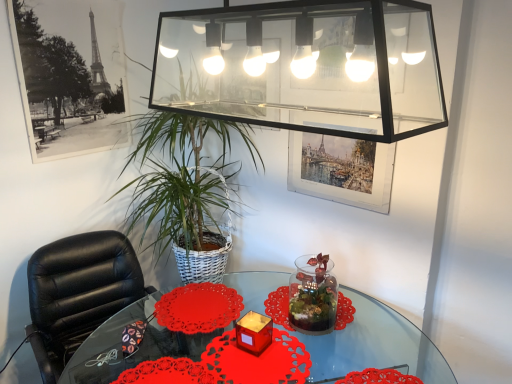
Identify the location of watercolor paper picture frame at upper center, which is counted as the first picture frame, starting from the right. (341, 169).

This screenshot has width=512, height=384. Describe the element at coordinates (313, 295) in the screenshot. I see `transparent glass vase at center` at that location.

Measure the distance between point [100,68] and camera.

Point [100,68] and camera are 2.02 meters apart from each other.

What is the approximate height of transparent glass table at center?

28.82 inches.

This screenshot has width=512, height=384. What do you see at coordinates (78, 293) in the screenshot? I see `black leather chair at left` at bounding box center [78, 293].

You are a GUI agent. You are given a task and a screenshot of the screen. Output one action in this format:
    pyautogui.click(x=<x>, y=<y>)
    Task: Click on the translucent glass candle at center
    Image resolution: width=512 pixels, height=384 pixels.
    Given the screenshot: What is the action you would take?
    pyautogui.click(x=254, y=332)

The height and width of the screenshot is (384, 512). Identify the location of watercolor paper picture frame at upper center, which is counted as the second picture frame, starting from the left. (341, 169).

From a real-world perspective, which object rests below the other?

transparent glass vase at center is physically lower.

What's the angular difference between transparent glass vase at center and black paper picture frame at upper left, acting as the second picture frame starting from the right,'s facing directions?

The angle between the facing direction of transparent glass vase at center and the facing direction of black paper picture frame at upper left, acting as the second picture frame starting from the right, is 4.14 degrees.

Is black paper picture frame at upper left, placed as the 1th picture frame when sorted from left to right, at the back of transparent glass vase at center?

No, transparent glass vase at center is not facing away from black paper picture frame at upper left, placed as the 1th picture frame when sorted from left to right.

Is transparent glass vase at center not close to black paper picture frame at upper left, acting as the second picture frame starting from the right?

Yes, transparent glass vase at center is far from black paper picture frame at upper left, acting as the second picture frame starting from the right.

Does translucent glass candle at center have a greater width compared to clear glass light fixture at upper center?

No.

Considering the sizes of objects translucent glass candle at center and clear glass light fixture at upper center in the image provided, who is taller, translucent glass candle at center or clear glass light fixture at upper center?

clear glass light fixture at upper center is taller.

Looking at the image, does translucent glass candle at center seem bigger or smaller compared to clear glass light fixture at upper center?

translucent glass candle at center is smaller than clear glass light fixture at upper center.

You are a GUI agent. You are given a task and a screenshot of the screen. Output one action in this format:
    pyautogui.click(x=<x>, y=<y>)
    Task: Click on the picture frame on the right of black paper picture frame at upper left, placed as the 1th picture frame when sorted from left to right
    This screenshot has height=384, width=512.
    Given the screenshot: What is the action you would take?
    pyautogui.click(x=341, y=169)

Considering the positions of points (329, 139) and (74, 92), is point (329, 139) farther from camera compared to point (74, 92)?

No.

Is watercolor paper picture frame at upper center, which is counted as the second picture frame, starting from the left, spatially inside black paper picture frame at upper left, placed as the 1th picture frame when sorted from left to right, or outside of it?

watercolor paper picture frame at upper center, which is counted as the second picture frame, starting from the left, cannot be found inside black paper picture frame at upper left, placed as the 1th picture frame when sorted from left to right.

From a real-world perspective, which is physically above, watercolor paper picture frame at upper center, which is counted as the second picture frame, starting from the left, or black paper picture frame at upper left, placed as the 1th picture frame when sorted from left to right?

black paper picture frame at upper left, placed as the 1th picture frame when sorted from left to right, from a real-world perspective.

Which of these two, translucent glass candle at center or red paper doily at center, is thinner?

With smaller width is translucent glass candle at center.

Is translucent glass candle at center positioned behind red paper doily at center?

No.

You are a GUI agent. You are given a task and a screenshot of the screen. Output one action in this format:
    pyautogui.click(x=<x>, y=<y>)
    Task: Click on the flower above the translucent glass candle at center (from the image's perspective)
    Image resolution: width=512 pixels, height=384 pixels.
    Given the screenshot: What is the action you would take?
    pyautogui.click(x=198, y=308)

From a real-world perspective, is translucent glass candle at center positioned above or below red paper doily at center?

Clearly, from a real-world perspective, translucent glass candle at center is above red paper doily at center.

From the image's perspective, which is below, translucent glass candle at center or transparent glass table at center?

From the image's view, transparent glass table at center is below.

Is translucent glass candle at center completely or partially outside of transparent glass table at center?

Yes, translucent glass candle at center is not within transparent glass table at center.

Can you confirm if translucent glass candle at center is wider than transparent glass table at center?

No, translucent glass candle at center is not wider than transparent glass table at center.

Considering the positions of objects translucent glass candle at center and transparent glass table at center in the image provided, who is more to the left, translucent glass candle at center or transparent glass table at center?

From the viewer's perspective, translucent glass candle at center appears more on the left side.

Is transparent glass table at center inside red paper doily at center?

No, transparent glass table at center is not surrounded by red paper doily at center.

Does red paper doily at center have a smaller size compared to transparent glass table at center?

Indeed, red paper doily at center has a smaller size compared to transparent glass table at center.

From a real-world perspective, is red paper doily at center beneath transparent glass table at center?

No, from a real-world perspective, red paper doily at center is not below transparent glass table at center.

Is red paper doily at center oriented towards transparent glass table at center?

Yes, red paper doily at center is aimed at transparent glass table at center.

Is black leather chair at left taller or shorter than black paper picture frame at upper left, placed as the 1th picture frame when sorted from left to right?

black leather chair at left is taller than black paper picture frame at upper left, placed as the 1th picture frame when sorted from left to right.

Which point is more distant from viewer, (x=76, y=239) or (x=104, y=98)?

The point (x=104, y=98) is farther from the camera.

From the image's perspective, between black leather chair at left and black paper picture frame at upper left, placed as the 1th picture frame when sorted from left to right, which one is located above?

black paper picture frame at upper left, placed as the 1th picture frame when sorted from left to right.

Which object is wider, black leather chair at left or black paper picture frame at upper left, acting as the second picture frame starting from the right?

black leather chair at left is wider.

Identify the location of vase below the black paper picture frame at upper left, acting as the second picture frame starting from the right (from a real-world perspective). This screenshot has width=512, height=384. (313, 295).

Where is `glass box that is in front of the translucent glass candle at center`? The height and width of the screenshot is (384, 512). glass box that is in front of the translucent glass candle at center is located at coordinates (305, 66).

Based on their spatial positions, is watercolor paper picture frame at upper center, which is counted as the second picture frame, starting from the left, or clear glass light fixture at upper center closer to black paper picture frame at upper left, acting as the second picture frame starting from the right?

watercolor paper picture frame at upper center, which is counted as the second picture frame, starting from the left, is positioned closer to the anchor black paper picture frame at upper left, acting as the second picture frame starting from the right.

Based on their spatial positions, is black leather chair at left or clear glass light fixture at upper center further from black paper picture frame at upper left, placed as the 1th picture frame when sorted from left to right?

The object further to black paper picture frame at upper left, placed as the 1th picture frame when sorted from left to right, is clear glass light fixture at upper center.

Consider the image. Looking at the image, which one is located further to black paper picture frame at upper left, placed as the 1th picture frame when sorted from left to right, clear glass light fixture at upper center or black leather chair at left?

Among the two, clear glass light fixture at upper center is located further to black paper picture frame at upper left, placed as the 1th picture frame when sorted from left to right.

Looking at the image, which one is located closer to red paper doily at center, transparent glass vase at center or watercolor paper picture frame at upper center, which is counted as the first picture frame, starting from the right?

transparent glass vase at center.

Considering their positions, is translucent glass candle at center positioned further to black leather chair at left than transparent glass table at center?

transparent glass table at center is positioned further to the anchor black leather chair at left.

Which object lies nearer to the anchor point transparent glass table at center, black paper picture frame at upper left, placed as the 1th picture frame when sorted from left to right, or transparent glass vase at center?

transparent glass vase at center is positioned closer to the anchor transparent glass table at center.

Which object lies nearer to the anchor point watercolor paper picture frame at upper center, which is counted as the first picture frame, starting from the right, clear glass light fixture at upper center or black leather chair at left?

clear glass light fixture at upper center is positioned closer to the anchor watercolor paper picture frame at upper center, which is counted as the first picture frame, starting from the right.

When comparing their distances from black paper picture frame at upper left, acting as the second picture frame starting from the right, does translucent glass candle at center or watercolor paper picture frame at upper center, which is counted as the first picture frame, starting from the right, seem closer?

watercolor paper picture frame at upper center, which is counted as the first picture frame, starting from the right, lies closer to black paper picture frame at upper left, acting as the second picture frame starting from the right, than the other object.

You are a GUI agent. You are given a task and a screenshot of the screen. Output one action in this format:
    pyautogui.click(x=<x>, y=<y>)
    Task: Click on the candle holder between clear glass light fixture at upper center and red paper doily at center along the z-axis
    The width and height of the screenshot is (512, 384).
    Given the screenshot: What is the action you would take?
    pyautogui.click(x=254, y=332)

Identify the location of flower between black paper picture frame at upper left, acting as the second picture frame starting from the right, and translucent glass candle at center vertically. The width and height of the screenshot is (512, 384). (198, 308).

Image resolution: width=512 pixels, height=384 pixels. I want to click on vase between clear glass light fixture at upper center and translucent glass candle at center from front to back, so click(x=313, y=295).

Locate an element on the screen. The image size is (512, 384). flower situated between black leather chair at left and watercolor paper picture frame at upper center, which is counted as the second picture frame, starting from the left, from left to right is located at coordinates (198, 308).